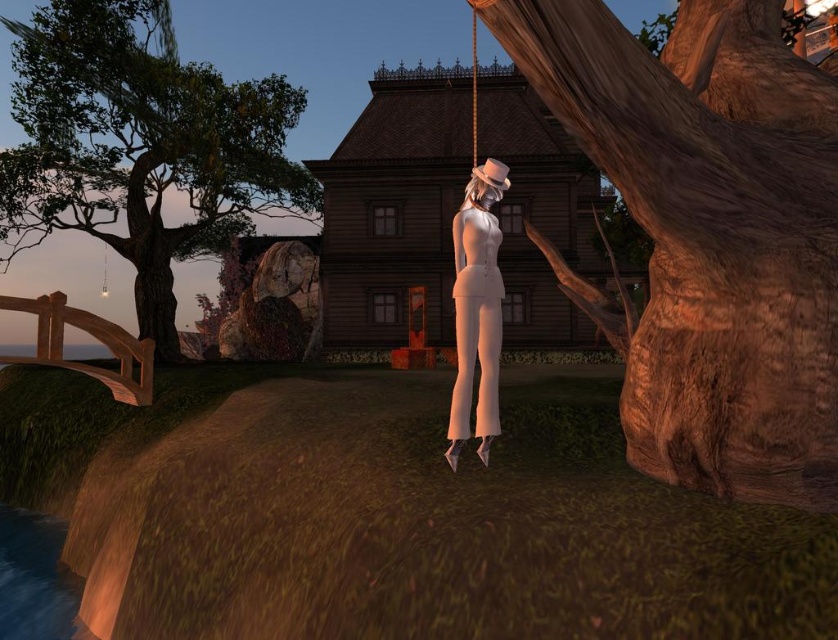
Question: Among these objects, which one is farthest from the camera?

Choices:
 (A) green leafy tree at left
 (B) white matte suit at center

Answer: (A)

Question: Which point is farther from the camera taking this photo?

Choices:
 (A) (476, 333)
 (B) (718, 436)
 (C) (133, 170)

Answer: (C)

Question: Does smooth brown bark at center right lie behind white matte suit at center?

Choices:
 (A) no
 (B) yes

Answer: (A)

Question: Does smooth brown bark at center right have a larger size compared to white matte suit at center?

Choices:
 (A) yes
 (B) no

Answer: (A)

Question: Which of the following is the closest to the observer?

Choices:
 (A) (473, 250)
 (B) (660, 260)

Answer: (B)

Question: Is green leafy tree at left closer to camera compared to white matte suit at center?

Choices:
 (A) no
 (B) yes

Answer: (A)